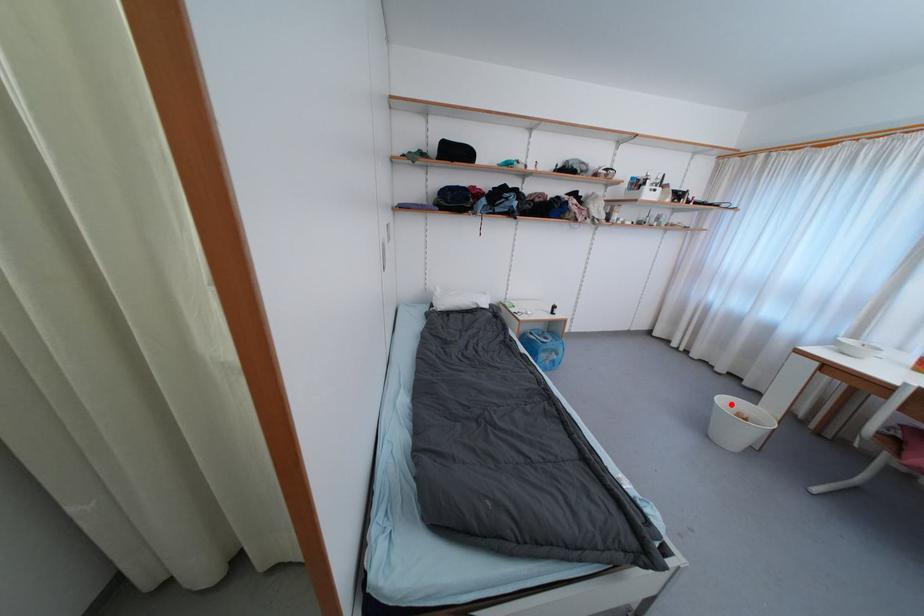
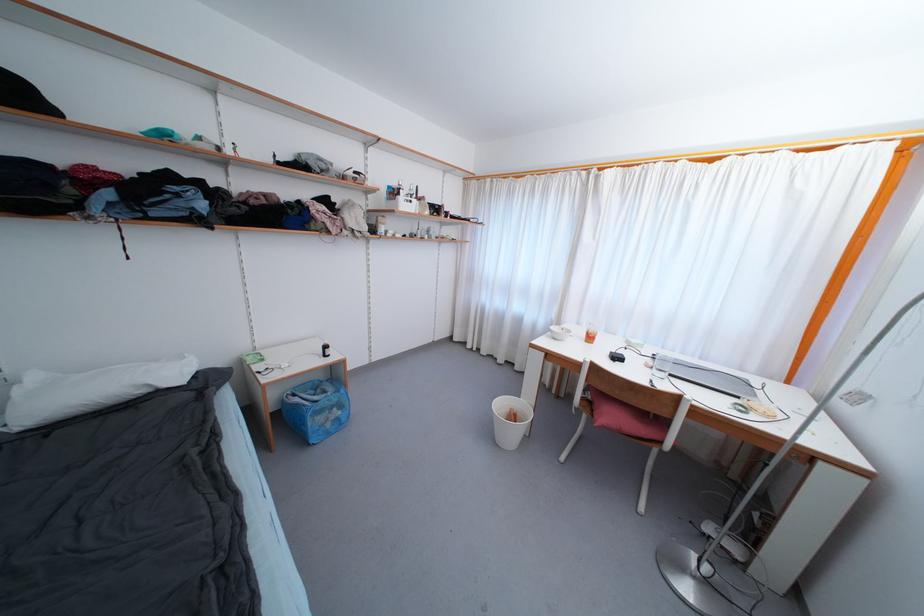
Where in the second image is the point corresponding to the highlighted location from the first image?

(505, 407)